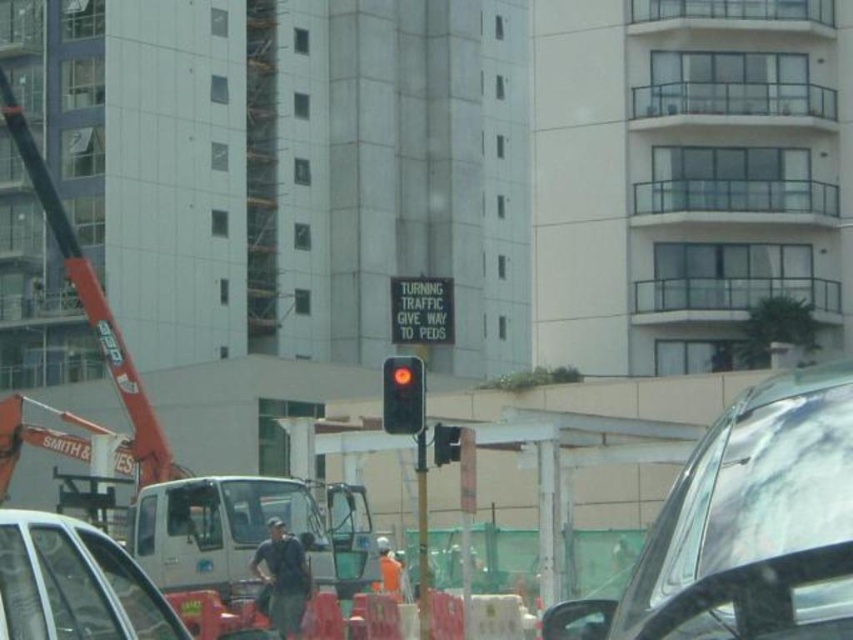
You are a pedestrian trying to cross the street at the intersection with the matte black traffic light at center. There is a shiny silver car at center blocking your path. Can you walk around it without stepping into the road?

The shiny silver car at center is taller than the matte black traffic light at center, so it is likely larger in size. However, since the traffic light is at the center, the car might be positioned in such a way that you can walk around it safely on the sidewalk. Check for any obstructions before proceeding.

You are a pedestrian standing at the intersection near the traffic light. You see a matte black car at lower left and an orange fabric man at center. Which object is closer to you?

The matte black car at lower left is closer to you because it is in front of the orange fabric man at center.

You are standing at the construction site and want to determine which of the two points, point (x=288, y=618) or point (x=433, y=458), is closer to you. Based on the scene, which point is nearer?

Point (x=288, y=618) is closer to you because it is further to the viewer than point (x=433, y=458).